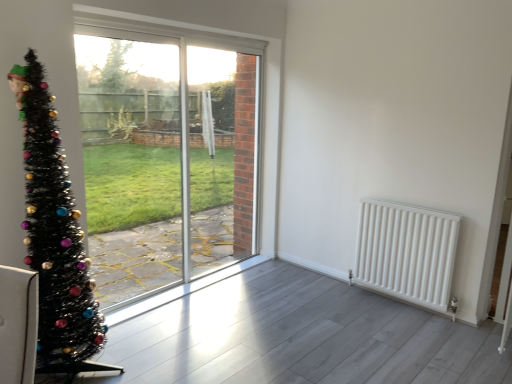
You are a GUI agent. You are given a task and a screenshot of the screen. Output one action in this format:
    pyautogui.click(x=<x>, y=<y>)
    Task: Click on the vacant area situated below white matte radiator at right (from a real-world perspective)
    The height and width of the screenshot is (384, 512).
    Given the screenshot: What is the action you would take?
    pyautogui.click(x=390, y=299)